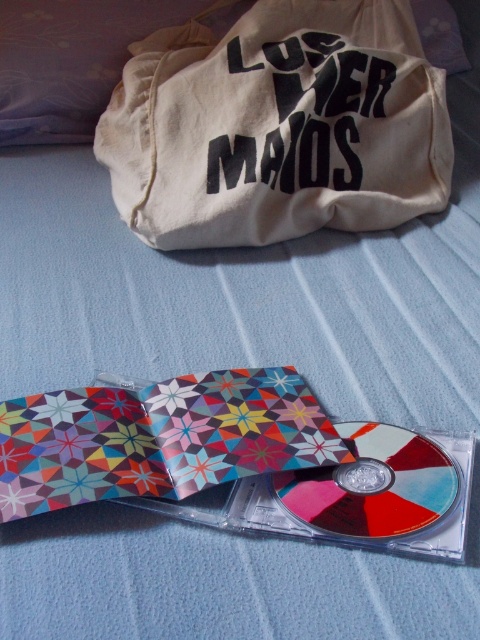
Does beige canvas bag at upper center appear under multicolored glossy cd at center?

No, beige canvas bag at upper center is not below multicolored glossy cd at center.

Is beige canvas bag at upper center positioned at the back of multicolored glossy cd at center?

That is True.

Between point (427, 77) and point (339, 518), which one is positioned in front?

Point (339, 518) is in front.

Locate an element on the screen. This screenshot has height=640, width=480. beige canvas bag at upper center is located at coordinates (277, 125).

Is beige canvas bag at upper center further to camera compared to multicolored paper cd case at center?

Yes.

Which of these two, beige canvas bag at upper center or multicolored paper cd case at center, stands shorter?

multicolored paper cd case at center

The image size is (480, 640). What do you see at coordinates (277, 125) in the screenshot?
I see `beige canvas bag at upper center` at bounding box center [277, 125].

The width and height of the screenshot is (480, 640). I want to click on beige canvas bag at upper center, so click(277, 125).

Who is higher up, multicolored paper cd case at center or multicolored glossy cd at center?

Positioned higher is multicolored paper cd case at center.

Which is in front, point (182, 396) or point (409, 449)?

Point (409, 449) is more forward.

Find the location of a particular element. The image size is (480, 640). multicolored paper cd case at center is located at coordinates (158, 436).